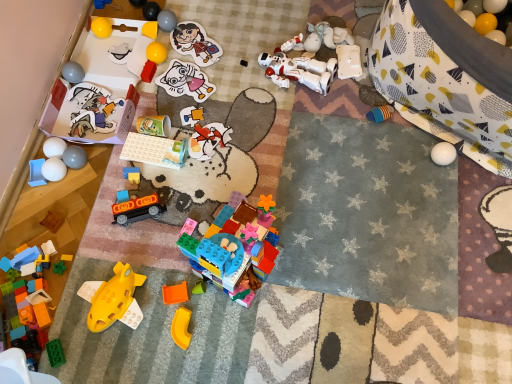
Find the location of a particular element. This screenshot has height=384, width=512. unoccupied region to the right of matte paper sticker at center, the seventh toy viewed from the right is located at coordinates (238, 87).